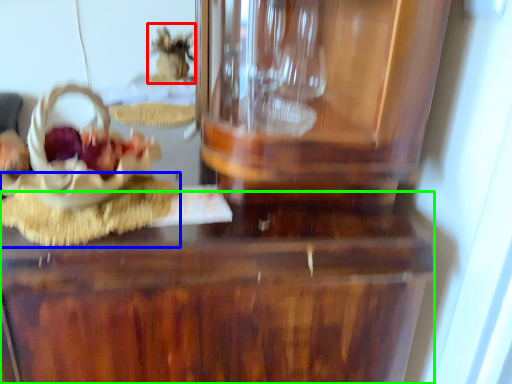
Question: Which object is positioned farthest from stuff (highlighted by a red box)? Select from food (highlighted by a blue box) and table (highlighted by a green box).

Choices:
 (A) food
 (B) table

Answer: (B)